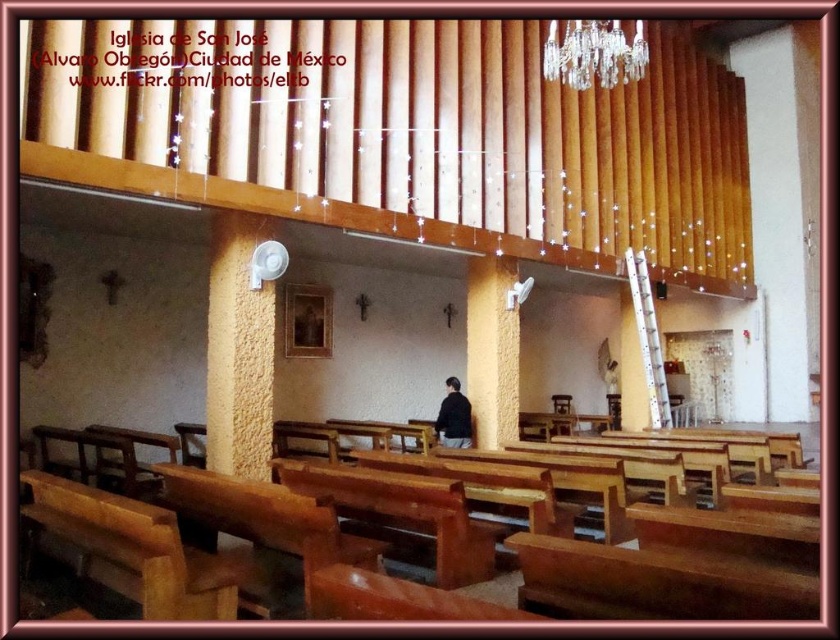
Question: Which object is positioned farthest from the black matte jacket at center?

Choices:
 (A) clear crystal chandelier at upper center
 (B) white metallic ladder at right

Answer: (A)

Question: Is wooden church bench at center closer to the viewer compared to black matte jacket at center?

Choices:
 (A) no
 (B) yes

Answer: (B)

Question: Does clear crystal chandelier at upper center appear on the left side of white metallic ladder at right?

Choices:
 (A) yes
 (B) no

Answer: (A)

Question: Which point is farther to the camera?

Choices:
 (A) (476, 586)
 (B) (592, 77)
 (C) (654, 397)
 (D) (455, 445)

Answer: (B)

Question: Is clear crystal chandelier at upper center thinner than wooden church bench at center?

Choices:
 (A) no
 (B) yes

Answer: (B)

Question: Which object is positioned farthest from the wooden church bench at center?

Choices:
 (A) clear crystal chandelier at upper center
 (B) black matte jacket at center

Answer: (A)